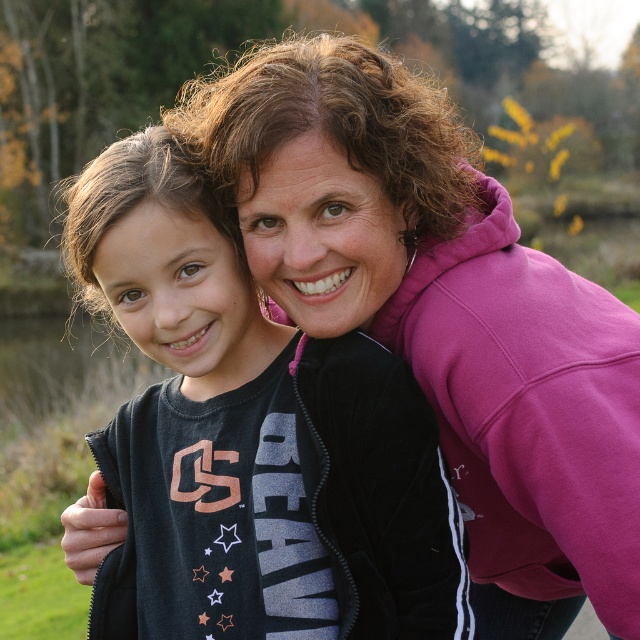
Who is more distant from viewer, [317,54] or [148,426]?

The point [148,426] is behind.

Does pink fleece at upper right have a greater width compared to black matte jacket at center?

Correct, the width of pink fleece at upper right exceeds that of black matte jacket at center.

Which is behind, point (301, 56) or point (108, 428)?

Point (108, 428)

This screenshot has width=640, height=640. In order to click on pink fleece at upper right in this screenshot , I will do `click(442, 312)`.